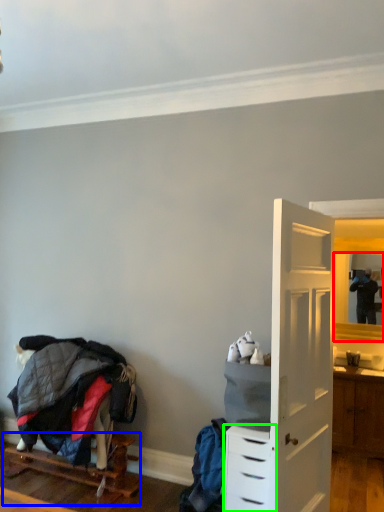
Question: Estimate the real-world distances between objects in this image. Which object is farther from mirror (highlighted by a red box), furniture (highlighted by a blue box) or chest of drawers (highlighted by a green box)?

Choices:
 (A) furniture
 (B) chest of drawers

Answer: (A)